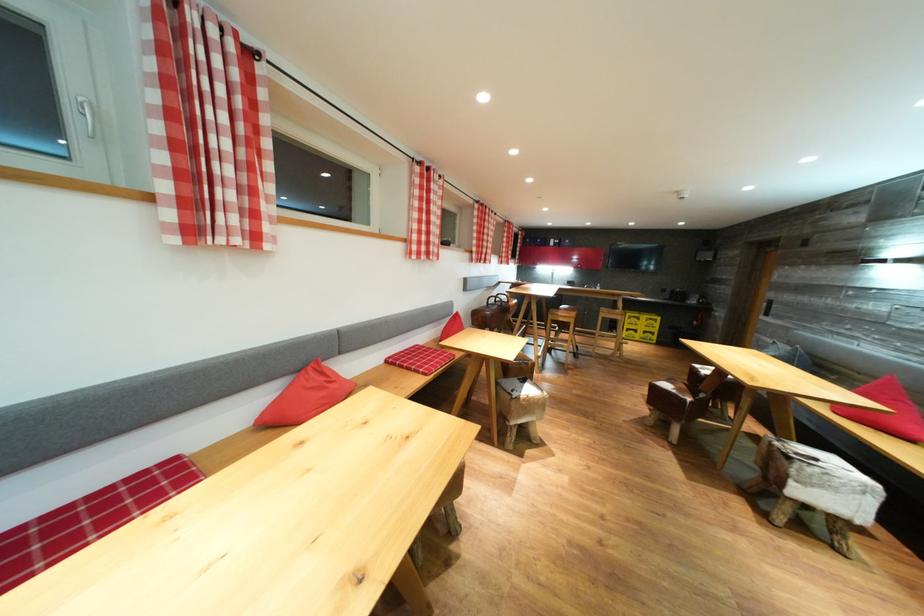
The location [306,395] corresponds to which object?

It corresponds to the red pillow in the image.